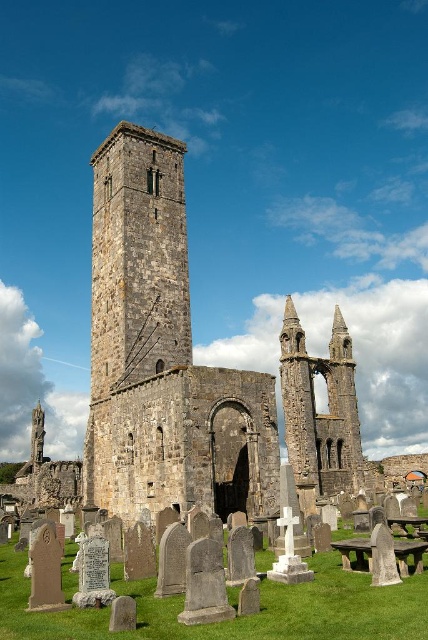
Does point (359, 474) come closer to viewer compared to point (139, 179)?

No, it is not.

Image resolution: width=428 pixels, height=640 pixels. What do you see at coordinates (163, 355) in the screenshot?
I see `stone tower at center` at bounding box center [163, 355].

Identify the location of stone tower at center. (163, 355).

Locate an element on the screen. stone tower at center is located at coordinates coord(163,355).

Who is more distant from viewer, (171, 483) or (353, 445)?

The point (353, 445) is more distant.

In the scene shown: Which is more to the left, stone tower at center or stone steeple at center?

From the viewer's perspective, stone tower at center appears more on the left side.

In order to click on stone tower at center in this screenshot , I will do `click(163, 355)`.

This screenshot has width=428, height=640. What are the coordinates of `stone tower at center` in the screenshot? It's located at (163, 355).

Looking at this image, does rustic stone tower at center appear over wooden picnic table at center?

Correct, rustic stone tower at center is located above wooden picnic table at center.

Does rustic stone tower at center appear under wooden picnic table at center?

Actually, rustic stone tower at center is above wooden picnic table at center.

Who is more distant from viewer, (103, 296) or (425, 548)?

The point (103, 296) is behind.

Image resolution: width=428 pixels, height=640 pixels. Find the location of `rustic stone tower at center`. rustic stone tower at center is located at coordinates (137, 259).